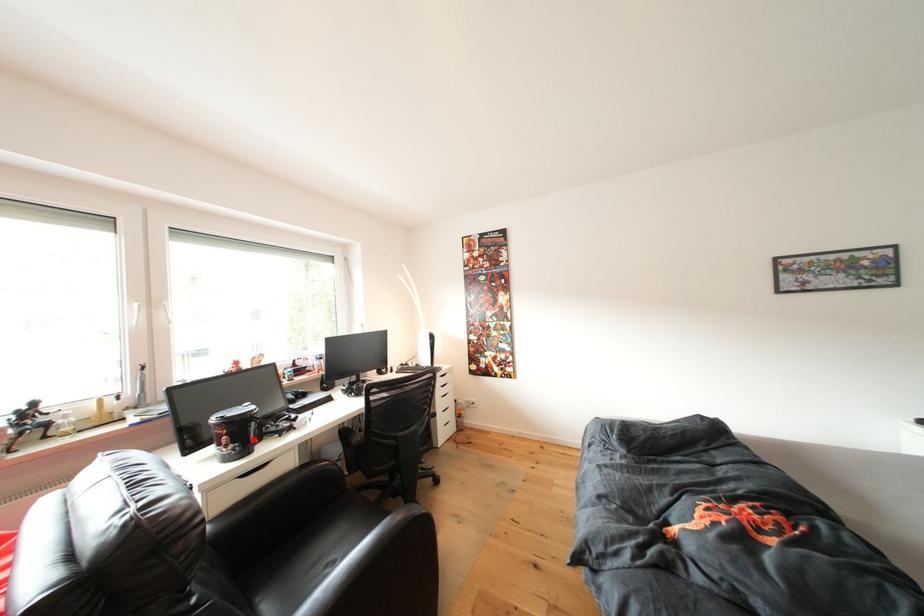
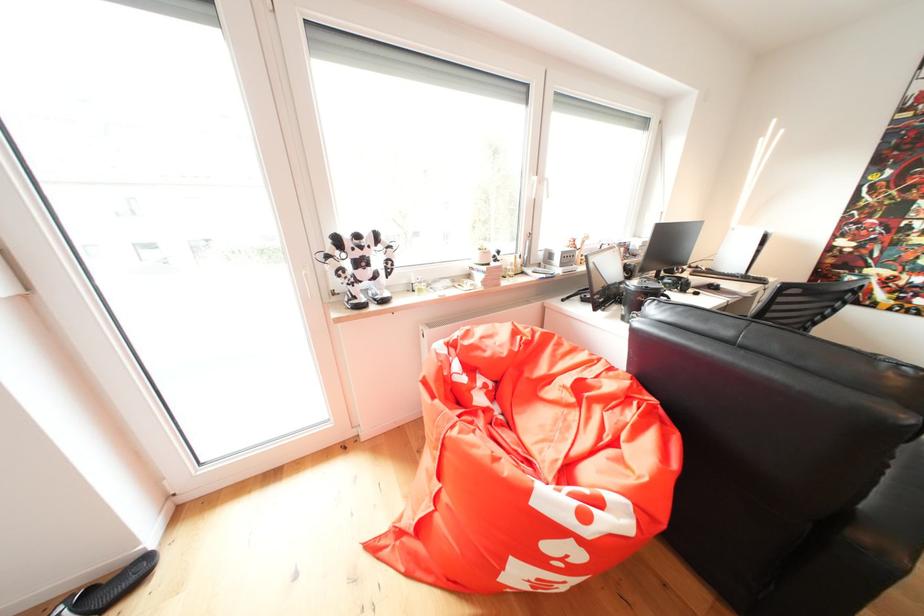
Question: I am providing you with two images of the same scene from different viewpoints. A red point is marked on the first image. Is the red point's position out of view in image 2?

Choices:
 (A) Yes
 (B) No

Answer: (A)